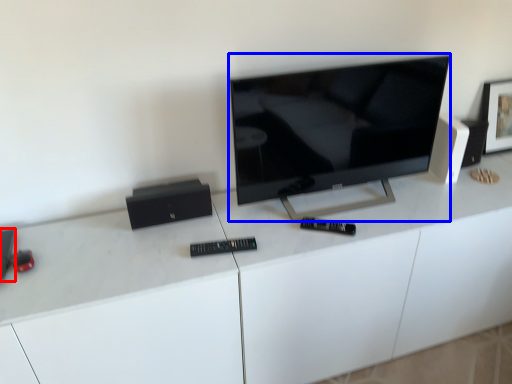
Question: Among these objects, which one is farthest to the camera, speaker (highlighted by a red box) or television (highlighted by a blue box)?

Choices:
 (A) speaker
 (B) television

Answer: (B)